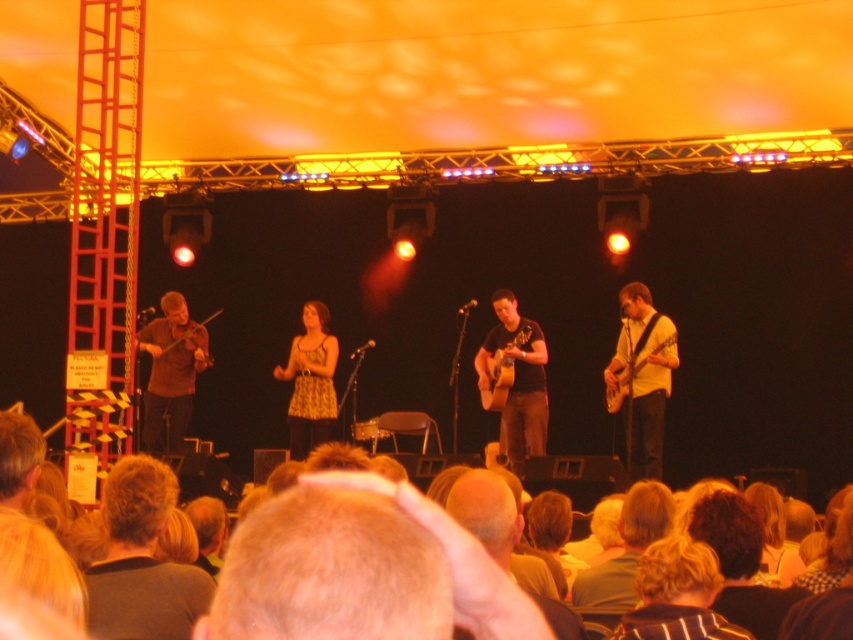
Is point (311, 340) in front of point (625, 380)?

No, it is not.

Who is taller, yellow printed dress at center or wooden acoustic guitar at center?

Standing taller between the two is yellow printed dress at center.

This screenshot has height=640, width=853. I want to click on yellow printed dress at center, so click(310, 381).

Does wooden violin at center appear under acoustic wood guitar at center?

Correct, wooden violin at center is located below acoustic wood guitar at center.

Is wooden violin at center smaller than acoustic wood guitar at center?

Actually, wooden violin at center might be larger than acoustic wood guitar at center.

Is point (163, 381) positioned after point (496, 365)?

Yes.

At what (x,y) coordinates should I click in order to perform the action: click on wooden violin at center. Please return your answer as a coordinate pair (x, y). This screenshot has width=853, height=640. Looking at the image, I should click on (170, 372).

Is point (502, 314) farther from viewer compared to point (502, 397)?

Yes, it is behind point (502, 397).

Who is higher up, matte brown acoustic guitar at center or acoustic wood guitar at center?

Positioned higher is acoustic wood guitar at center.

What are the coordinates of `matte brown acoustic guitar at center` in the screenshot? It's located at (517, 380).

This screenshot has width=853, height=640. Identify the location of matte brown acoustic guitar at center. (517, 380).